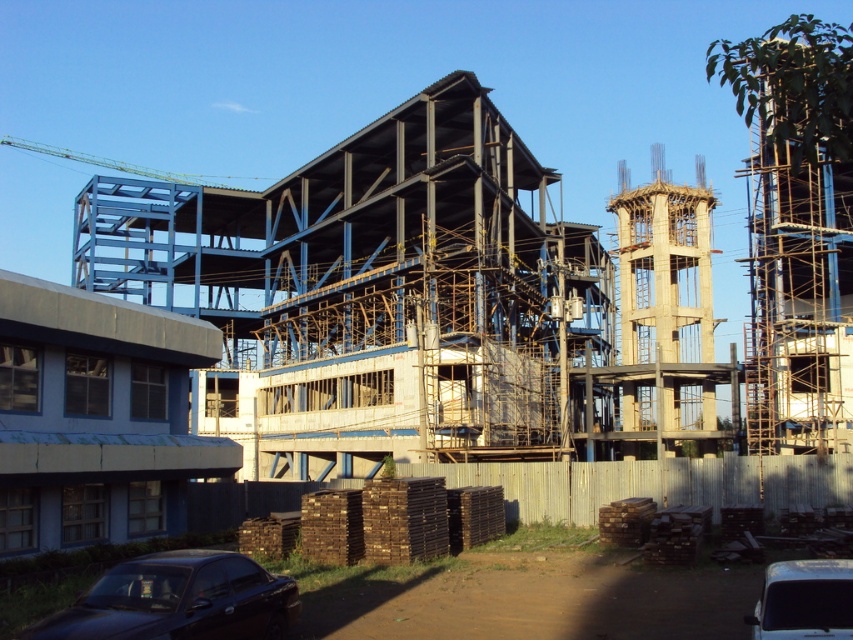
You are a delivery driver arriving at the construction site. You need to park your white matte van at lower right near the entrance. However, there is a metallic blue crane at upper left in the way. Can you drive your van through the space between them without hitting the crane?

The white matte van at lower right is not as tall as the metallic blue crane at upper left, so yes, you can drive your van through the space between them without hitting the crane since the crane is taller and there is vertical clearance.

You are a delivery driver who needs to park your vehicle in the construction site. You have a shiny black car at lower left and a white matte van at lower right. Which vehicle is blocking the other from moving forward?

The shiny black car at lower left is positioned under white matte van at lower right, meaning the van is blocking the car from moving forward.